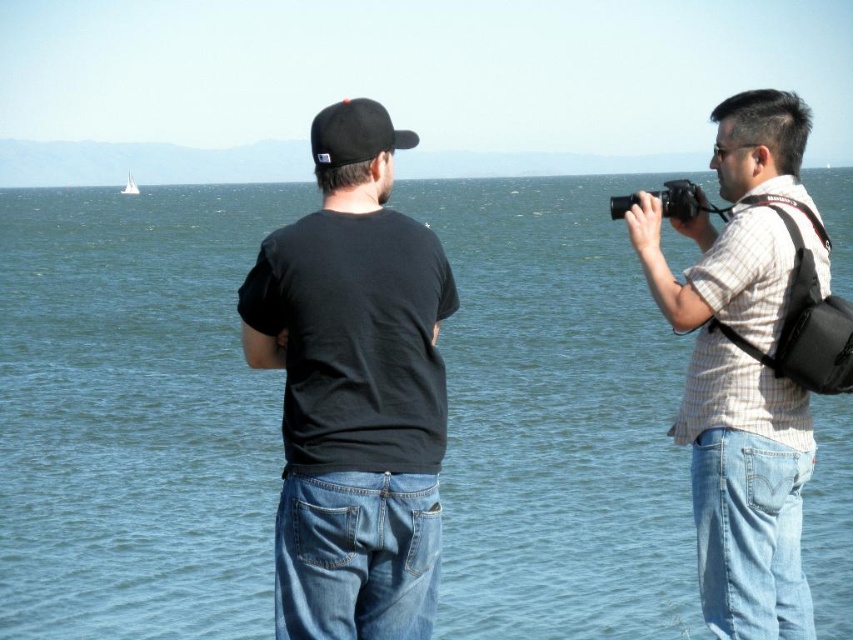
You are a photographer trying to capture both the plaid shirt at right and the black matte baseball cap at center in a single frame. Based on their positions, which subject should you focus on first to ensure both are in focus?

You should focus on the plaid shirt at right first because it is closer to you than the black matte baseball cap at center, so focusing on the closer subject will help both be in focus.

You are a photographer trying to capture the blue water at upper center and the black plastic camera at right in a single frame. Based on their positions, which object will appear larger in the photo?

The blue water at upper center will appear larger in the photo because it is taller than the black plastic camera at right.